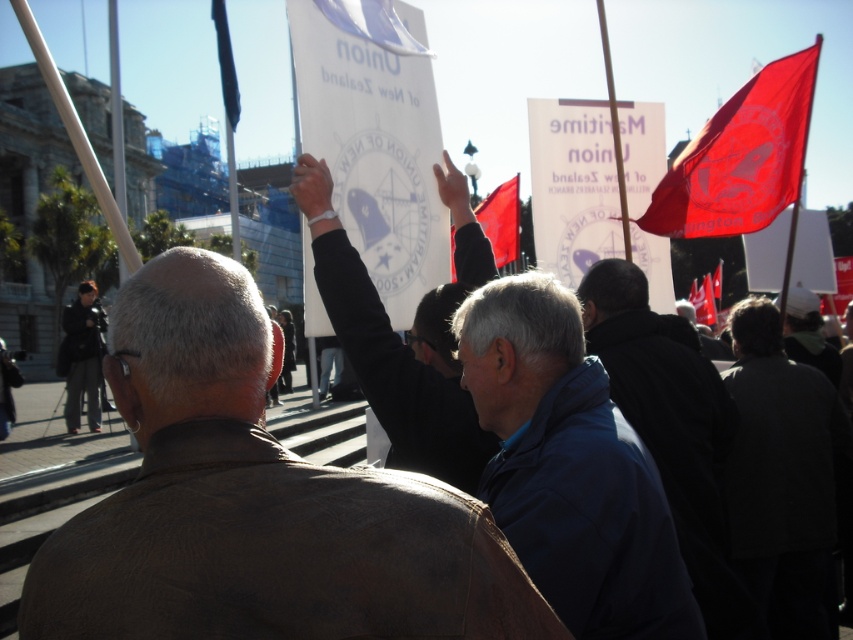
Is blue fabric jacket at center above dark gray jacket at lower right?

Yes.

How distant is blue fabric jacket at center from dark gray jacket at lower right?

They are 9.85 meters apart.

The width and height of the screenshot is (853, 640). What do you see at coordinates (569, 467) in the screenshot? I see `blue fabric jacket at center` at bounding box center [569, 467].

Identify the location of blue fabric jacket at center. (569, 467).

Between point (175, 576) and point (224, 19), which one is positioned in front?

Point (175, 576) is in front.

Which is more to the left, brown corduroy jacket at center or blue fabric flag at upper left?

blue fabric flag at upper left is more to the left.

Which is in front, point (225, 458) or point (230, 120)?

Point (225, 458)

Where is `brown corduroy jacket at center`? Image resolution: width=853 pixels, height=640 pixels. brown corduroy jacket at center is located at coordinates (256, 502).

Consider the image. Does dark gray jacket at lower right have a greater width compared to dark gray jacket at lower left?

No.

Who is positioned more to the right, dark gray jacket at lower right or dark gray jacket at lower left?

dark gray jacket at lower right is more to the right.

Locate an element on the screen. The image size is (853, 640). dark gray jacket at lower right is located at coordinates (782, 477).